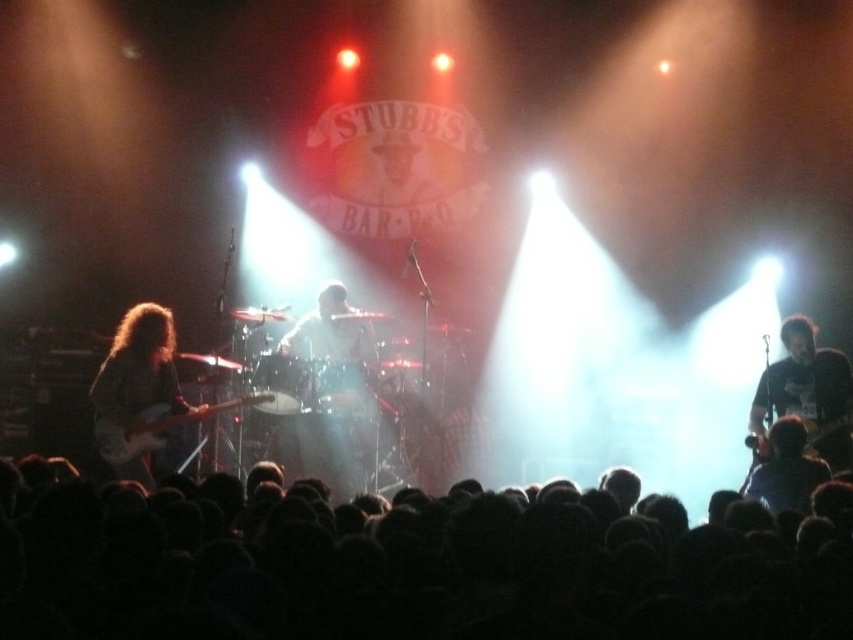
Does black hair at lower center have a lesser height compared to black matte guitar at right?

Correct, black hair at lower center is not as tall as black matte guitar at right.

Between point (109, 573) and point (811, 326), which one is positioned behind?

Positioned behind is point (811, 326).

Who is more forward, (x=616, y=596) or (x=834, y=365)?

Point (x=616, y=596) is more forward.

At what (x,y) coordinates should I click in order to perform the action: click on black hair at lower center. Please return your answer as a coordinate pair (x, y). Looking at the image, I should click on (416, 576).

Is shiny black guitar at left positioned in front of dark blue shirt at lower right?

No, shiny black guitar at left is behind dark blue shirt at lower right.

Is point (158, 316) positioned after point (751, 474)?

Yes.

This screenshot has height=640, width=853. I want to click on shiny black guitar at left, so click(138, 388).

Which of these two, white matte drum set at center or matte black electric guitar at left, stands taller?

white matte drum set at center is taller.

Does white matte drum set at center lie behind matte black electric guitar at left?

Yes, white matte drum set at center is further from the viewer.

Describe the element at coordinates (335, 452) in the screenshot. I see `white matte drum set at center` at that location.

At what (x,y) coordinates should I click in order to perform the action: click on white matte drum set at center. Please return your answer as a coordinate pair (x, y). This screenshot has width=853, height=640. Looking at the image, I should click on (335, 452).